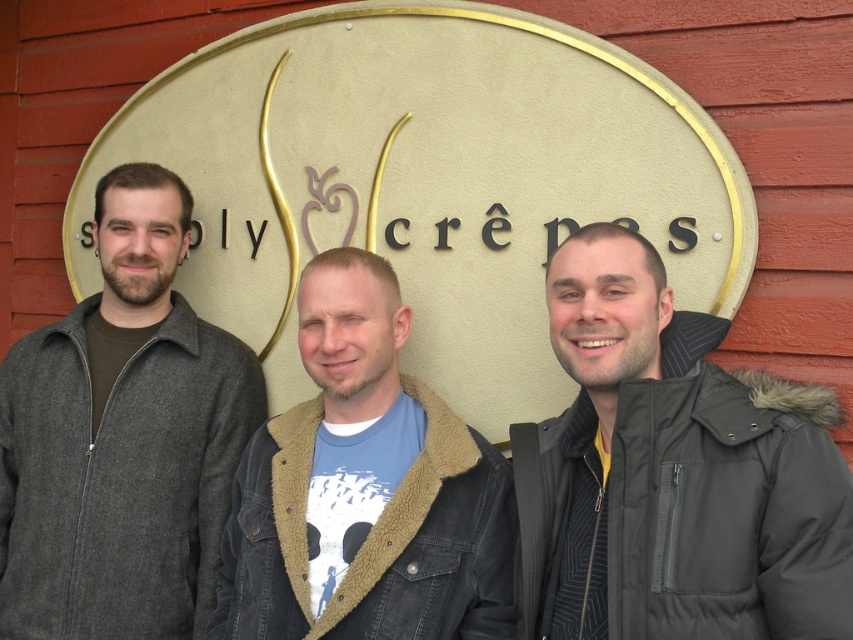
In the scene of three people in front of a cr?pes sign, the dark gray puffy jacket at center and dark gray woolen jacket at left are both visible. Which jacket has a smaller width?

The dark gray puffy jacket at center is thinner than the dark gray woolen jacket at left, so the dark gray puffy jacket at center has a smaller width.